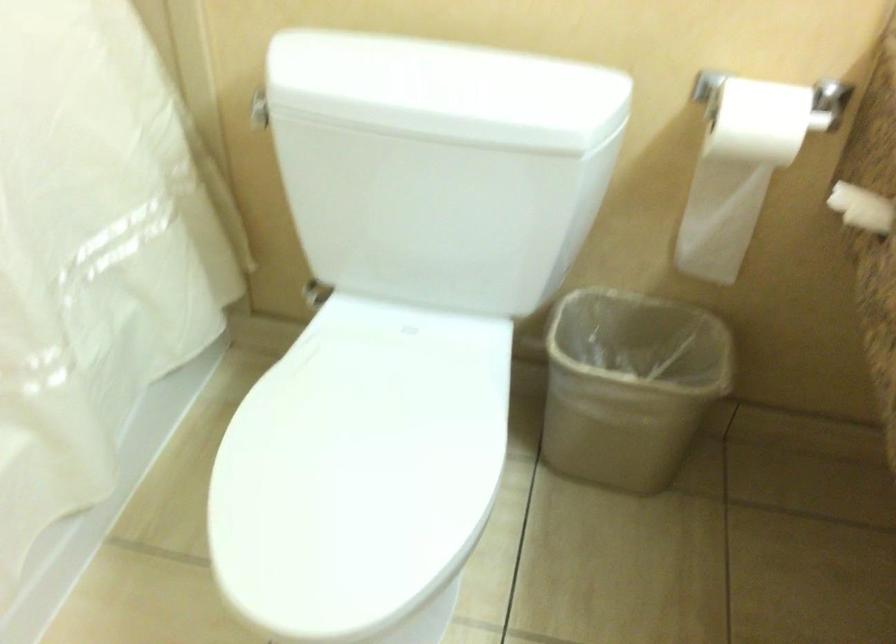
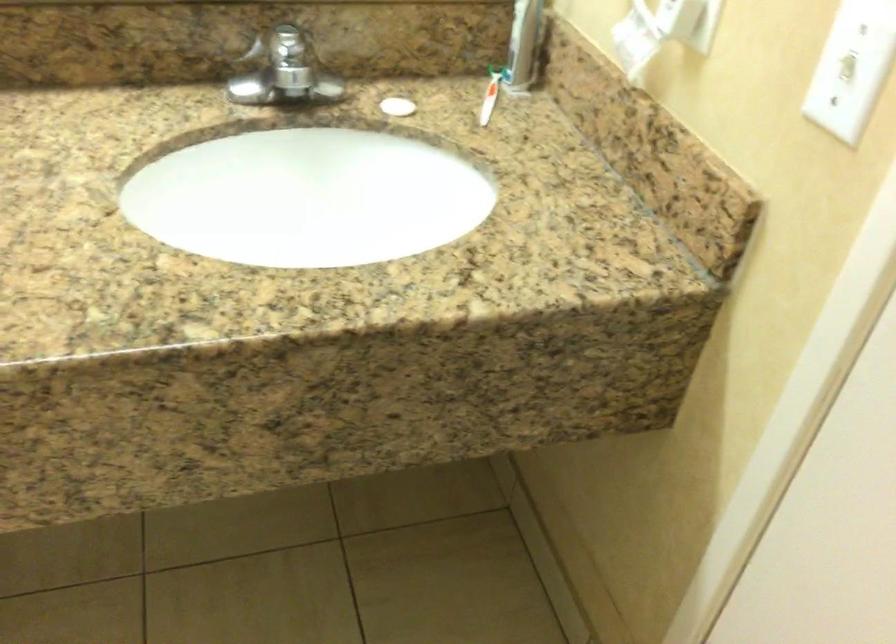
The first image is from the beginning of the video and the second image is from the end. How did the camera likely rotate when shooting the video?

The camera rotated toward right-down.